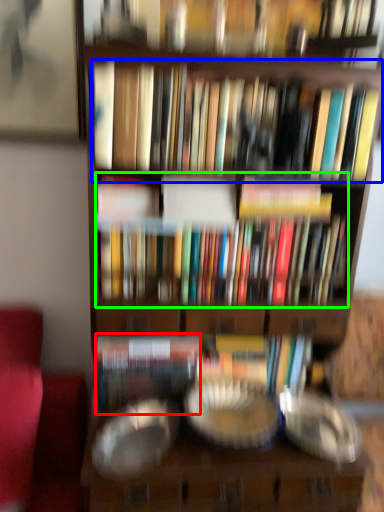
Question: Which object is positioned farthest from paperback book (highlighted by a red box)? Select from book (highlighted by a blue box) and book (highlighted by a green box).

Choices:
 (A) book
 (B) book

Answer: (A)